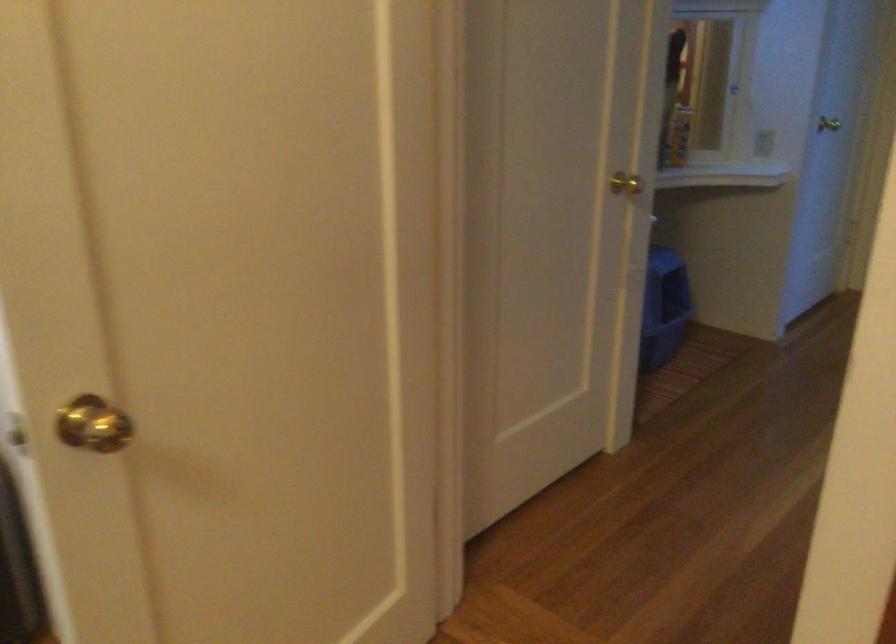
Find where to push the light switch. Please return your answer as a coordinate pair (x, y).

(762, 143)